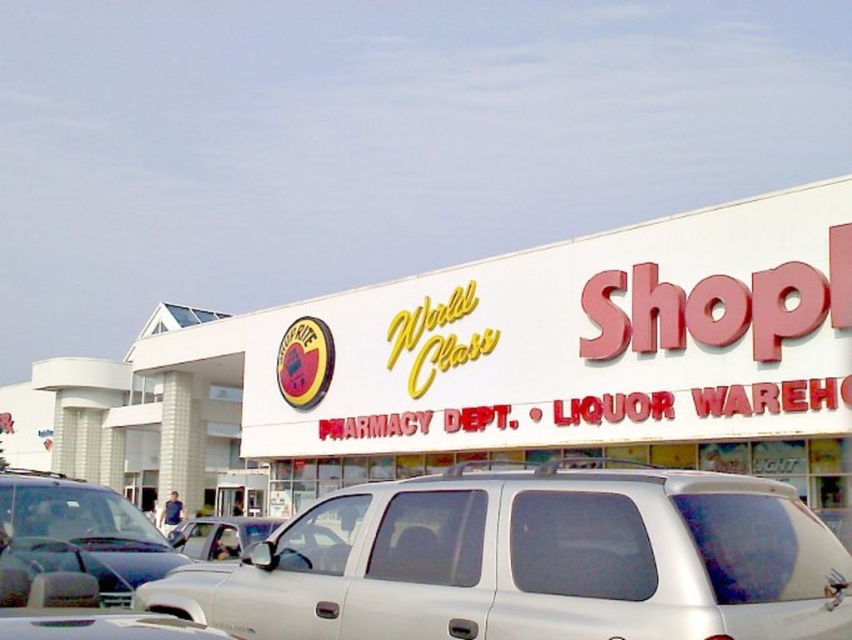
Is white matte building at center positioned at the back of shiny silver suv at lower left?

Yes, white matte building at center is further from the viewer.

Between point (369, 417) and point (130, 513), which one is positioned in front?

Point (130, 513) is in front.

The height and width of the screenshot is (640, 852). What are the coordinates of `white matte building at center` in the screenshot? It's located at (458, 374).

Can you confirm if shiny silver suv at lower left is taller than metallic silver suv at center?

Yes, shiny silver suv at lower left is taller than metallic silver suv at center.

Which is in front, point (33, 524) or point (197, 541)?

Point (33, 524) is in front.

Identify the location of shiny silver suv at lower left. (79, 532).

Describe the element at coordinates (458, 374) in the screenshot. This screenshot has height=640, width=852. I see `white matte building at center` at that location.

Is white matte building at center positioned in front of white matte minivan at center?

No, white matte building at center is further to the viewer.

The width and height of the screenshot is (852, 640). What do you see at coordinates (458, 374) in the screenshot?
I see `white matte building at center` at bounding box center [458, 374].

Locate an element on the screen. Image resolution: width=852 pixels, height=640 pixels. white matte building at center is located at coordinates (458, 374).